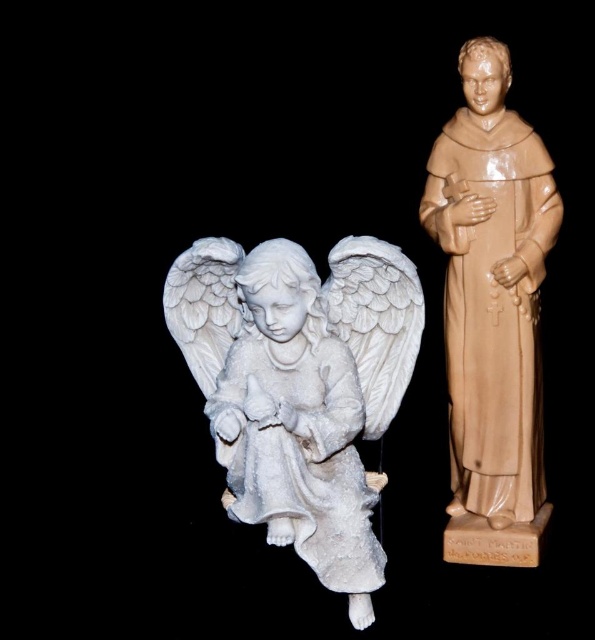
What do you see at coordinates (300, 385) in the screenshot? I see `white marble angel at left` at bounding box center [300, 385].

Does point (296, 536) lie behind point (493, 285)?

No, it is not.

Locate an element on the screen. white marble angel at left is located at coordinates (300, 385).